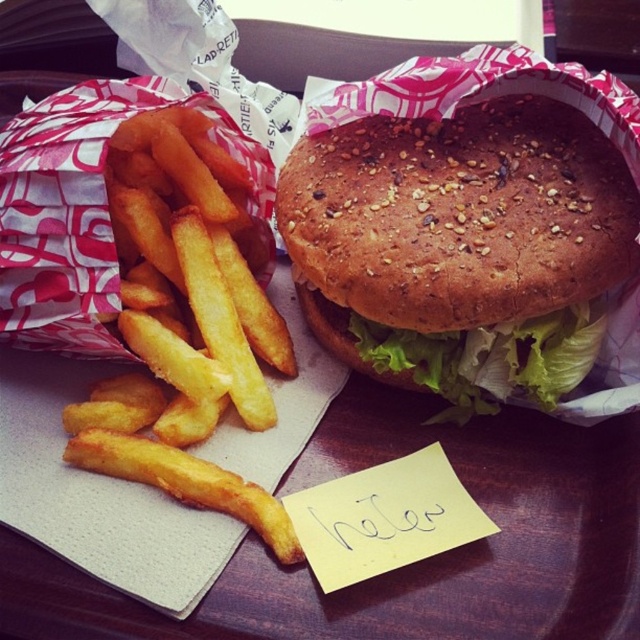
Question: Can you confirm if golden crispy french fries at left is smaller than green leafy lettuce at center?

Choices:
 (A) yes
 (B) no

Answer: (B)

Question: Does sesame seed bun at center appear on the right side of golden crispy french fries at left?

Choices:
 (A) yes
 (B) no

Answer: (A)

Question: Which object is the farthest from the golden crispy french fries at left?

Choices:
 (A) sesame seed bun at center
 (B) green leafy lettuce at center

Answer: (B)

Question: Where is sesame seed bun at center located in relation to golden crispy french fries at left in the image?

Choices:
 (A) below
 (B) above

Answer: (B)

Question: Which object appears farthest from the camera in this image?

Choices:
 (A) sesame seed bun at center
 (B) green leafy lettuce at center
 (C) golden crispy french fries at left

Answer: (B)

Question: Which of the following is the farthest from the observer?

Choices:
 (A) golden crispy french fries at left
 (B) sesame seed bun at center
 (C) green leafy lettuce at center

Answer: (C)